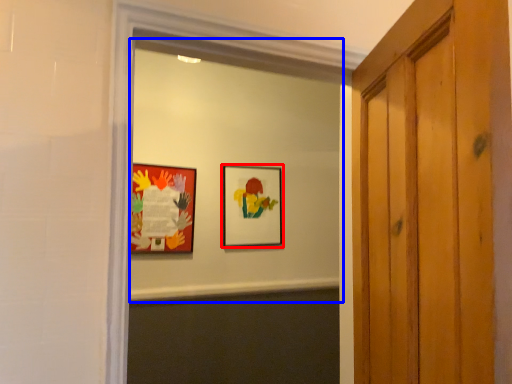
Question: Which object appears closest to the camera in this image, picture frame (highlighted by a red box) or mirror (highlighted by a blue box)?

Choices:
 (A) picture frame
 (B) mirror

Answer: (B)